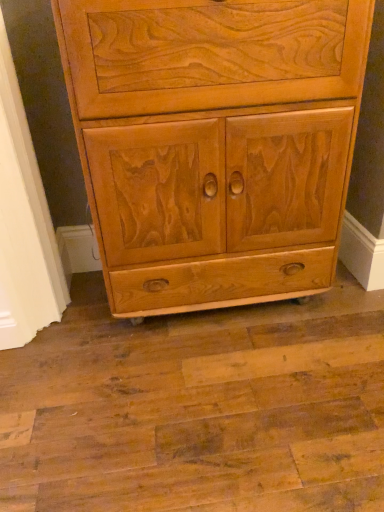
Question: Is matte wood cabinet at center inside the boundaries of matte wood cabinet at lower left, or outside?

Choices:
 (A) outside
 (B) inside

Answer: (A)

Question: Does point (185, 169) appear closer or farther from the camera than point (26, 212)?

Choices:
 (A) farther
 (B) closer

Answer: (B)

Question: Is matte wood cabinet at center in front of or behind matte wood cabinet at lower left in the image?

Choices:
 (A) behind
 (B) front

Answer: (B)

Question: Is matte wood cabinet at lower left inside or outside of matte wood cabinet at center?

Choices:
 (A) inside
 (B) outside

Answer: (B)

Question: Is matte wood cabinet at lower left in front of or behind matte wood cabinet at center in the image?

Choices:
 (A) behind
 (B) front

Answer: (A)

Question: From their relative heights in the image, would you say matte wood cabinet at lower left is taller or shorter than matte wood cabinet at center?

Choices:
 (A) short
 (B) tall

Answer: (B)

Question: Looking at their shapes, would you say matte wood cabinet at lower left is wider or thinner than matte wood cabinet at center?

Choices:
 (A) thin
 (B) wide

Answer: (A)